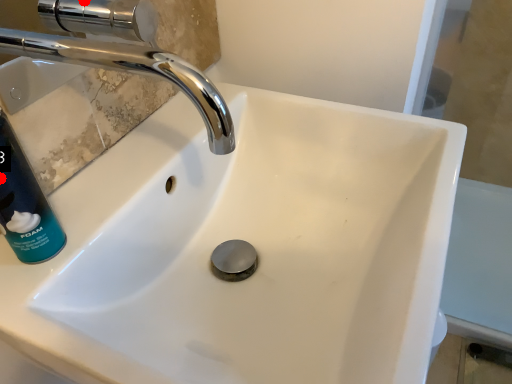
Question: Two points are circled on the image, labeled by A and B beside each circle. Which point is closer to the camera taking this photo?

Choices:
 (A) A is closer
 (B) B is closer

Answer: (B)